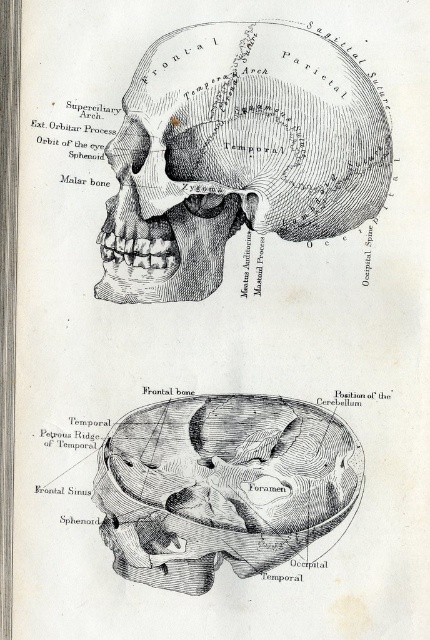
Question: Is etched paper skull at upper center bigger than black ink drawing of skull at center?

Choices:
 (A) no
 (B) yes

Answer: (B)

Question: Which of the following is the closest to the observer?

Choices:
 (A) etched paper skull at upper center
 (B) black ink drawing of skull at center

Answer: (A)

Question: Does etched paper skull at upper center have a greater width compared to black ink drawing of skull at center?

Choices:
 (A) no
 (B) yes

Answer: (B)

Question: Which object is closer to the camera taking this photo?

Choices:
 (A) black ink drawing of skull at center
 (B) etched paper skull at upper center

Answer: (B)

Question: Does etched paper skull at upper center have a lesser width compared to black ink drawing of skull at center?

Choices:
 (A) yes
 (B) no

Answer: (B)